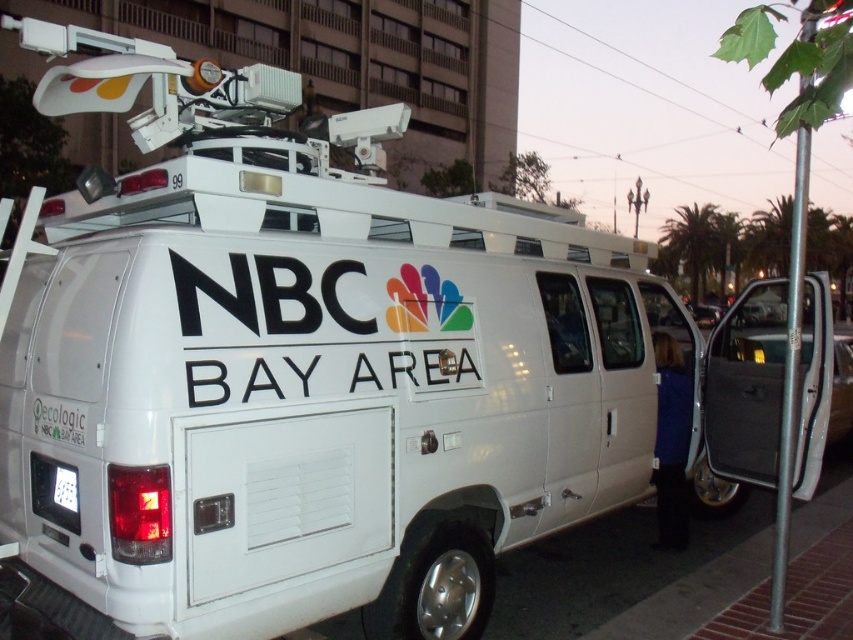
You are a delivery person who needs to attach a package to the van. The package requires a minimum of 2 inches of space between the two license plates. Can you fit the package between the white plastic license plate at lower left and the white plastic license plate at rear?

The distance between the white plastic license plate at lower left and the white plastic license plate at rear is 1.84 inches, which is less than the required 2 inches. Therefore, the package cannot be safely attached between them.

Based on the photo, you are standing on the sidewalk next to the white van described in the scene. You want to read the text on the white plastic license plate at lower left. Can you read it clearly without moving closer?

The white plastic license plate at lower left is 9.17 feet away from viewer, so yes, you can read it clearly without moving closer since it is within a typical comfortable reading distance.